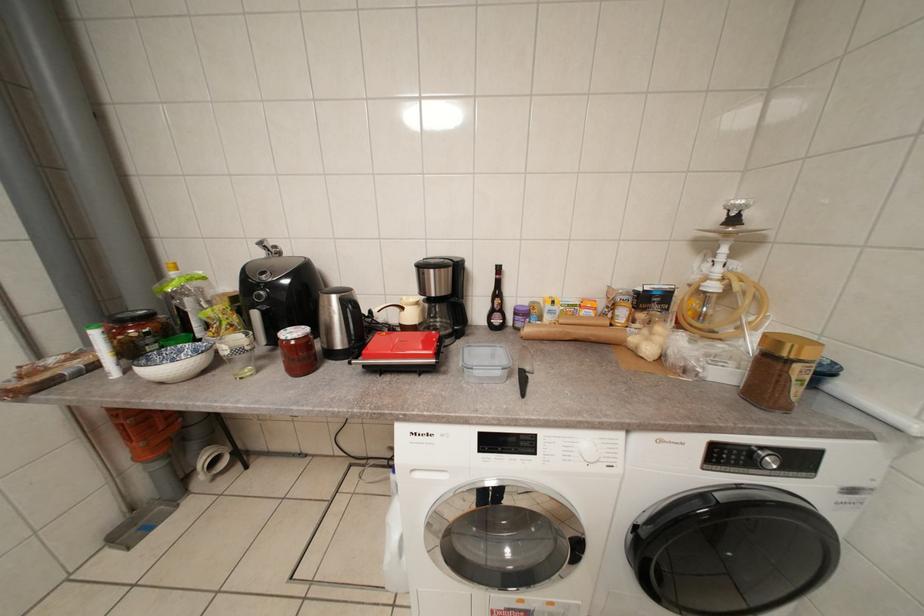
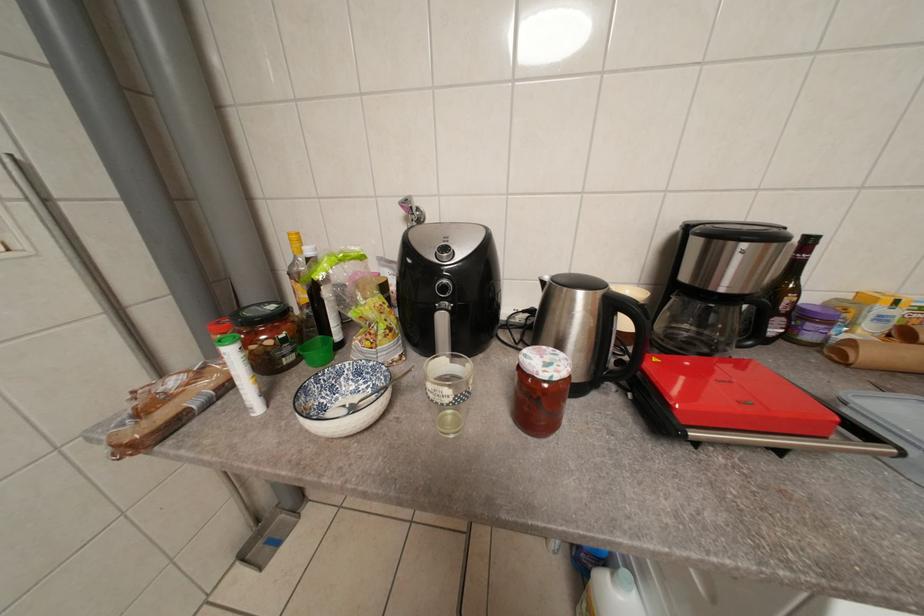
Question: Based on the continuous images, in which direction is the camera rotating? Reply with the corresponding letter.

Choices:
 (A) Left
 (B) Right
 (C) Up
 (D) Down

Answer: (A)